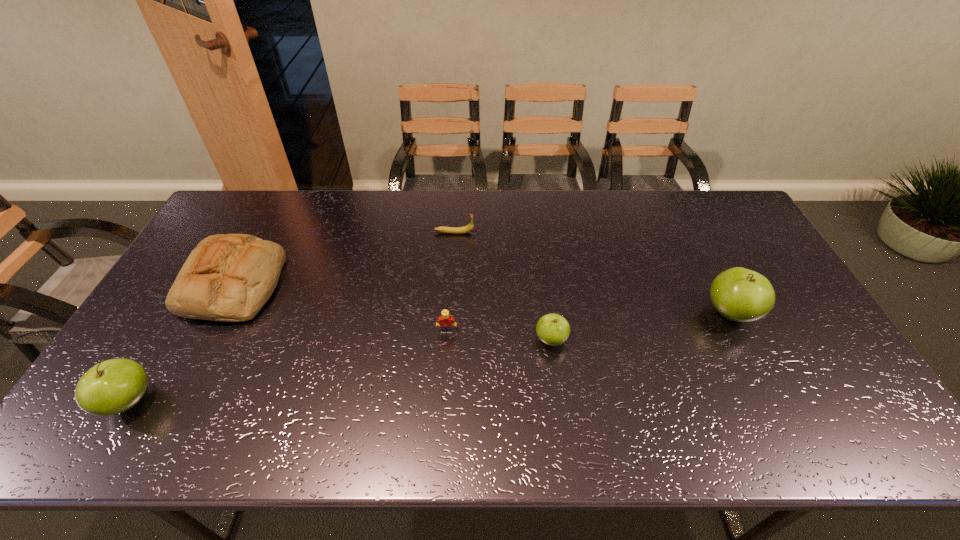
Where is `the nearest apple`? The image size is (960, 540). the nearest apple is located at coordinates (111, 387).

You are a GUI agent. You are given a task and a screenshot of the screen. Output one action in this format:
    pyautogui.click(x=<x>, y=<y>)
    Task: Click on the nearest object
    Image resolution: width=960 pixels, height=540 pixels.
    Given the screenshot: What is the action you would take?
    [111, 387]

At what (x,y) coordinates should I click in order to perform the action: click on the shortest apple. Please return your answer as a coordinate pair (x, y). This screenshot has height=540, width=960. Looking at the image, I should click on (x=552, y=329).

Image resolution: width=960 pixels, height=540 pixels. In order to click on the second apple from right to left in this screenshot , I will do `click(552, 329)`.

Identify the location of the rightmost apple. (739, 294).

You are a GUI agent. You are given a task and a screenshot of the screen. Output one action in this format:
    pyautogui.click(x=<x>, y=<y>)
    Task: Click on the bread
    Image resolution: width=960 pixels, height=540 pixels.
    Given the screenshot: What is the action you would take?
    pyautogui.click(x=229, y=278)

The width and height of the screenshot is (960, 540). I want to click on Lego, so click(x=446, y=322).

Locate an element on the screen. banana is located at coordinates 451,230.

This screenshot has height=540, width=960. In order to click on free spot located on the back of the second shortest apple in this screenshot , I will do `click(156, 357)`.

Where is `free space located 0.060m on the front of the second apple from right to left`? Image resolution: width=960 pixels, height=540 pixels. free space located 0.060m on the front of the second apple from right to left is located at coordinates (556, 373).